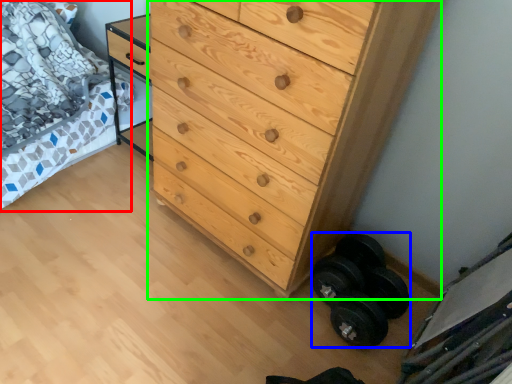
Question: Estimate the real-world distances between objects in this image. Which object is farther from bed (highlighted by a red box), dumbbell (highlighted by a blue box) or chest of drawers (highlighted by a green box)?

Choices:
 (A) dumbbell
 (B) chest of drawers

Answer: (A)